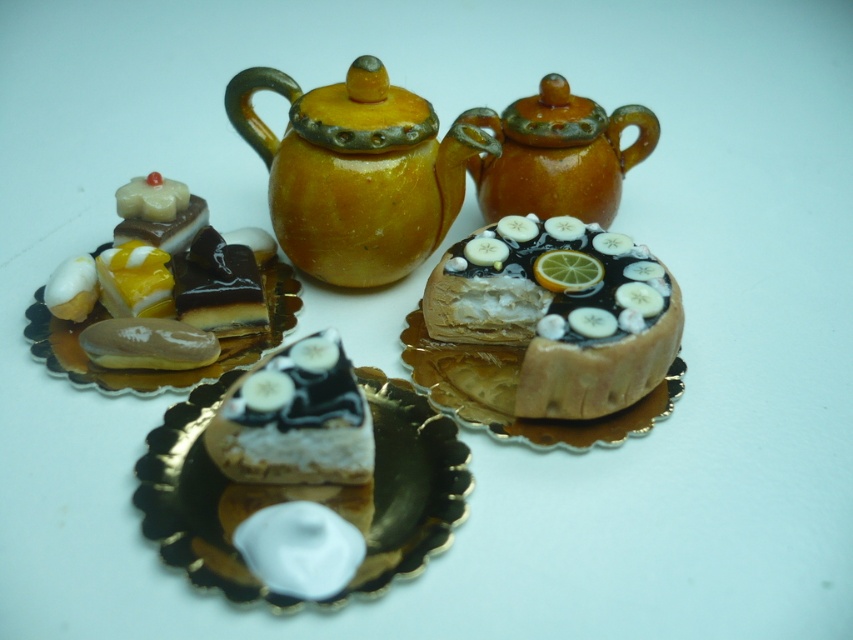
You are a food stylist arranging miniature desserts on a plate. You have two cakes in front of you, the chocolate glazed cake at center and the white glossy cake at center. Which cake should you place in a taller container to ensure they both fit properly?

The chocolate glazed cake at center is taller than the white glossy cake at center, so you should place the chocolate glazed cake at center in a taller container to accommodate its height.

From the picture: You are looking at the miniature food arrangement on the table. There are two points marked as point (268, 403) and point (466, 118). Which point is closer to you?

Point (268, 403) is closer to you because it is in front of point (466, 118).